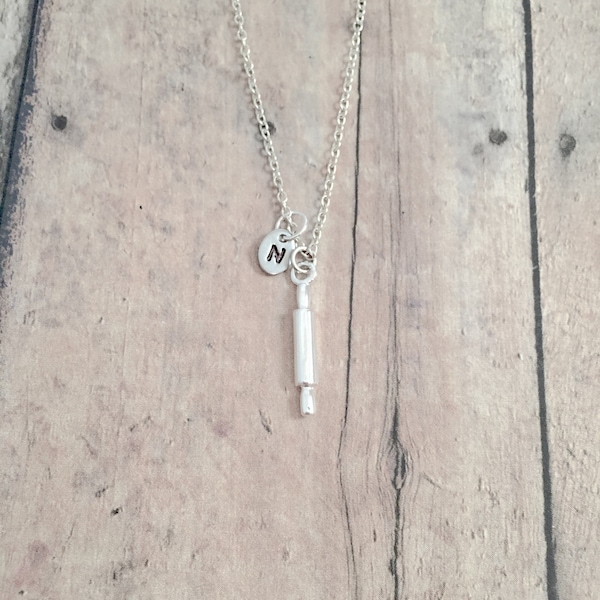
You are a GUI agent. You are given a task and a screenshot of the screen. Output one action in this format:
    pyautogui.click(x=<x>, y=<y>)
    Task: Click on the top narrow part of pendant
    
    Given the screenshot: What is the action you would take?
    pyautogui.click(x=302, y=297)